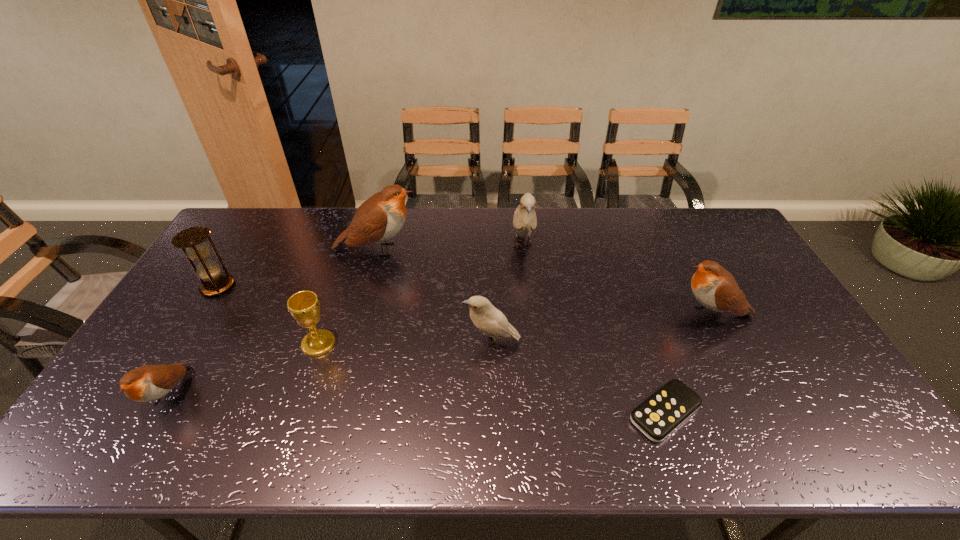
You are a GUI agent. You are given a task and a screenshot of the screen. Output one action in this format:
    pyautogui.click(x=<x>, y=<y>)
    Task: Click on the free region at the far edge of the desktop
    The image size is (960, 540).
    Given the screenshot: What is the action you would take?
    pyautogui.click(x=578, y=209)

Locate an element on the screen. This screenshot has height=540, width=960. vacant space at the near edge of the desktop is located at coordinates (487, 430).

At what (x,y) coordinates should I click in order to perform the action: click on vacant space at the right edge of the desktop. Please return your answer as a coordinate pair (x, y). Image resolution: width=960 pixels, height=540 pixels. Looking at the image, I should click on point(756,275).

Image resolution: width=960 pixels, height=540 pixels. Identify the location of free space at the near left corner of the desktop. (134, 437).

The image size is (960, 540). In order to click on empty location between the rightmost object and the nearer white bird in this screenshot , I will do `click(602, 328)`.

At what (x,y) coordinates should I click in order to perform the action: click on free space that is in between the leftmost brown bird and the gold chalice. Please return your answer as a coordinate pair (x, y). This screenshot has width=960, height=540. Looking at the image, I should click on (244, 369).

The image size is (960, 540). In order to click on vacant space that is in between the rightmost bird and the gold chalice in this screenshot , I will do `click(516, 329)`.

At what (x,y) coordinates should I click in order to perform the action: click on vacant area that lies between the remote control and the bigger white bird. Please return your answer as a coordinate pair (x, y). Looking at the image, I should click on (593, 329).

Identify the location of free point between the rightmost brown bird and the second nearest bird. The width and height of the screenshot is (960, 540). (602, 328).

What are the coordinates of `free space between the gold chalice and the smallest brown bird` in the screenshot? It's located at 244,369.